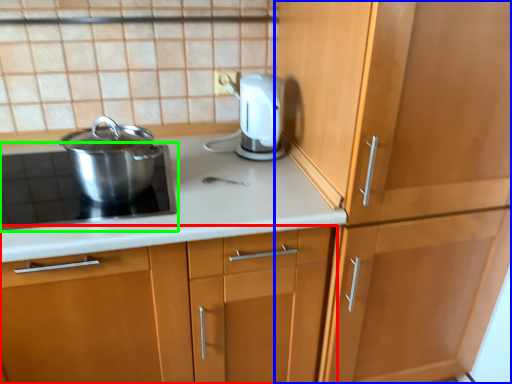
Question: Considering the real-world distances, which object is farthest from cabinetry (highlighted by a red box)? cabinetry (highlighted by a blue box) or home appliance (highlighted by a green box)?

Choices:
 (A) cabinetry
 (B) home appliance

Answer: (A)